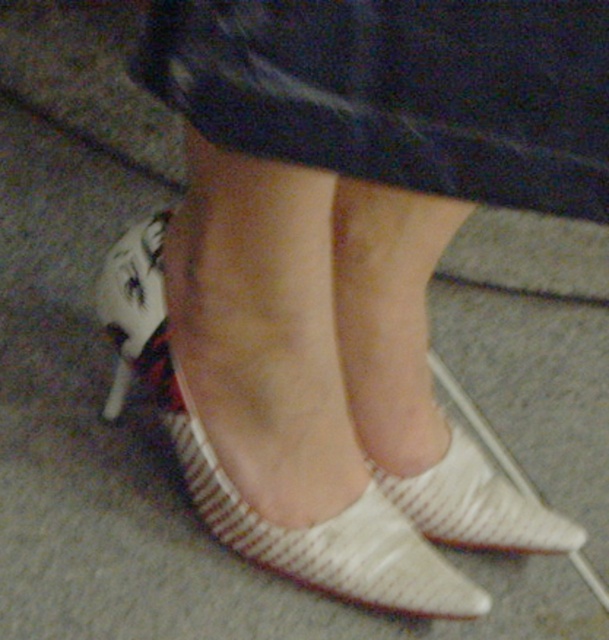
Which is behind, point (191, 90) or point (128, 381)?

Positioned behind is point (128, 381).

What do you see at coordinates (400, 92) in the screenshot? I see `white textured dress at center` at bounding box center [400, 92].

The width and height of the screenshot is (609, 640). Describe the element at coordinates (400, 92) in the screenshot. I see `white textured dress at center` at that location.

Where is `white textured dress at center`? The image size is (609, 640). white textured dress at center is located at coordinates (400, 92).

What do you see at coordinates (400, 92) in the screenshot? The image size is (609, 640). I see `white textured dress at center` at bounding box center [400, 92].

Is point (596, 33) behind point (434, 472)?

No, it is not.

Is point (593, 154) more distant than point (476, 520)?

No.

Identify the location of white textured dress at center. The width and height of the screenshot is (609, 640). (400, 92).

Is point (150, 394) positioned before point (410, 509)?

No, (150, 394) is behind (410, 509).

Who is positioned more to the right, white textured sandal at lower center or white textured shoe at center?

white textured shoe at center

Which is behind, point (147, 221) or point (530, 525)?

The point (147, 221) is more distant.

The image size is (609, 640). What are the coordinates of `white textured sandal at lower center` in the screenshot? It's located at (234, 486).